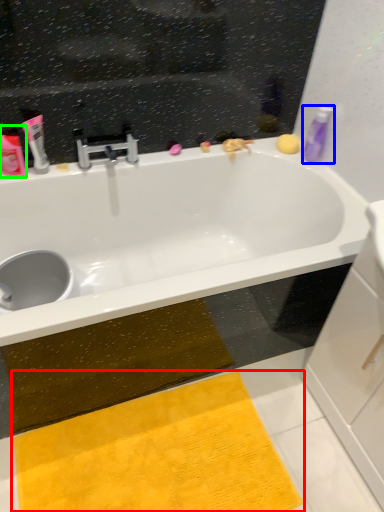
Question: Considering the real-world distances, which object is closest to doormat (highlighted by a red box)? toiletry (highlighted by a blue box) or toiletry (highlighted by a green box).

Choices:
 (A) toiletry
 (B) toiletry

Answer: (B)